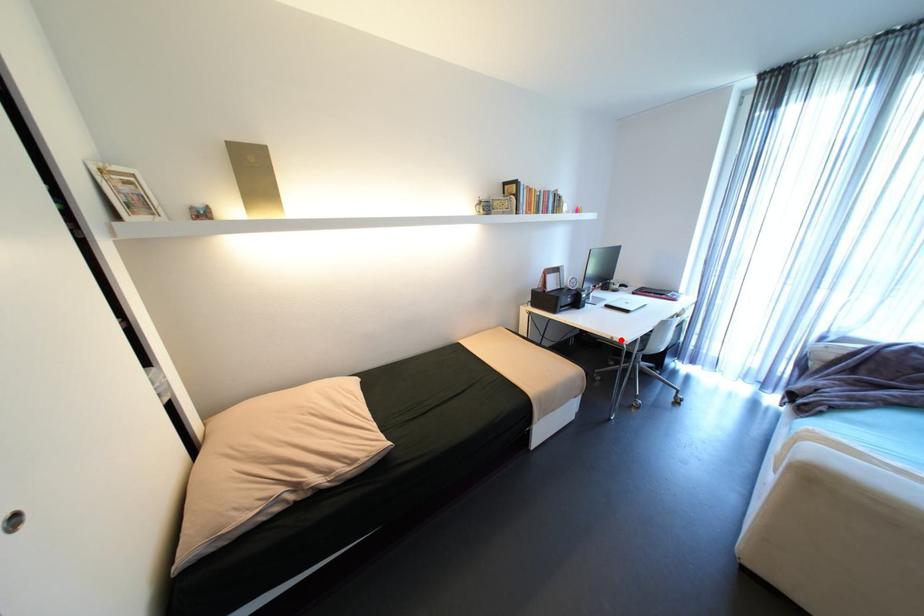
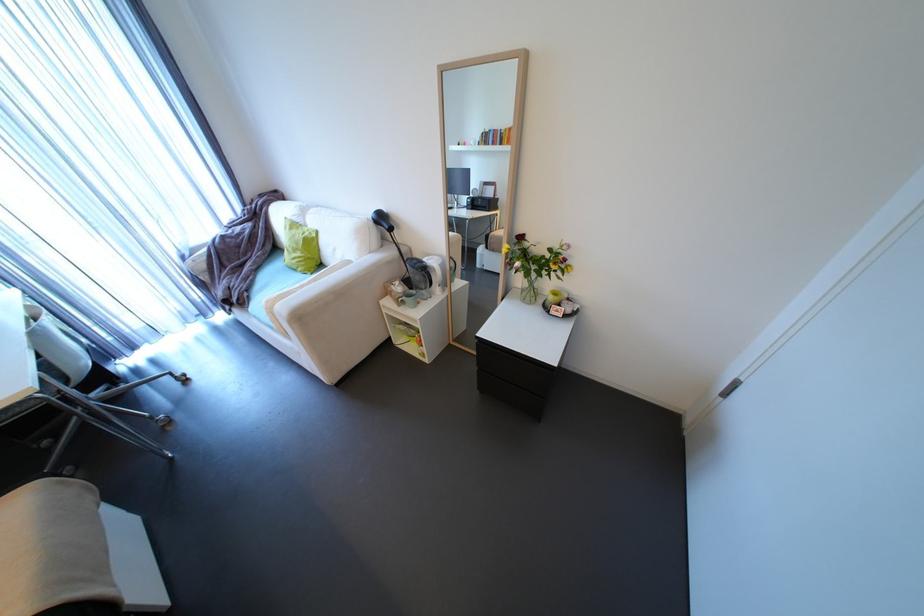
Question: I am providing you with two images of the same scene from different viewpoints. A red point is marked on the first image. At the location where the point appears in image 1, is it still visible in image 2?

Choices:
 (A) Yes
 (B) No

Answer: (A)